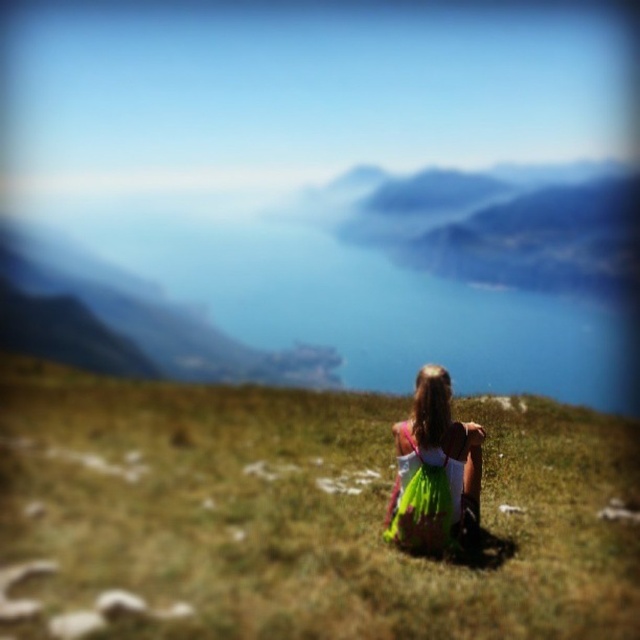
Question: Does green grassy at center appear over green satin dress at center?

Choices:
 (A) no
 (B) yes

Answer: (A)

Question: Does green grassy at center appear on the left side of green satin dress at center?

Choices:
 (A) yes
 (B) no

Answer: (A)

Question: Can you confirm if green grassy at center is positioned above green satin dress at center?

Choices:
 (A) yes
 (B) no

Answer: (B)

Question: Which object is closer to the camera taking this photo?

Choices:
 (A) green satin dress at center
 (B) green grassy at center

Answer: (B)

Question: Among these points, which one is farthest from the camera?

Choices:
 (A) (378, 467)
 (B) (476, 524)

Answer: (A)